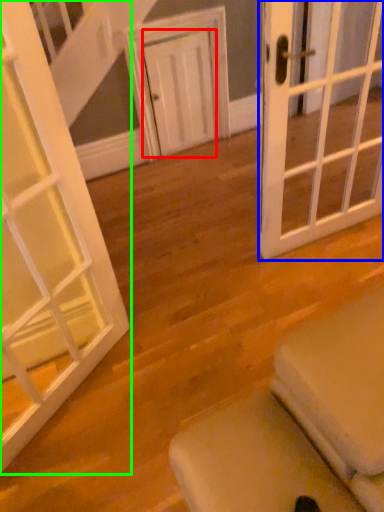
Question: Which is nearer to the door (highlighted by a red box)? door (highlighted by a blue box) or door (highlighted by a green box).

Choices:
 (A) door
 (B) door

Answer: (A)